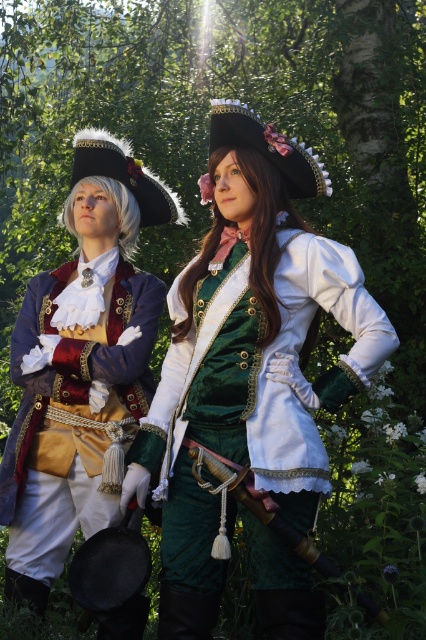
You are standing in front of a historical painting depicting two people in period costumes. The person on the left is wearing a dark blue coat with gold buttons, a red vest, and a black tricorn hat with white fur trim and a red flower. The person on the right has long brown hair and is dressed in a similar style but with a different color scheme. There is a point marked at coordinates point (307,518). If you were to throw a small pebble from your current position towards the painting, would it land near

The point (307,518) is 13.11 feet away from the viewer. Since the pebble is thrown from the viewer position, it would land near point (307,518) if aimed correctly, as that is the location specified in the coordinates.

You are a costume designer trying to decide which green velvet garment to choose for a historical play. The scene requires a larger outfit for the main character. Which one should you pick between the green velvet jacket at center and the green velvet coat at center?

The green velvet jacket at center is bigger than the green velvet coat at center, so you should choose the green velvet jacket at center for the main character.

You are a costume designer trying to decide which green velvet garment to use for a historical play. You need to choose between the green velvet jacket at center and the green velvet coat at center based on their height. Which one is taller?

The green velvet coat at center is taller than the green velvet jacket at center.